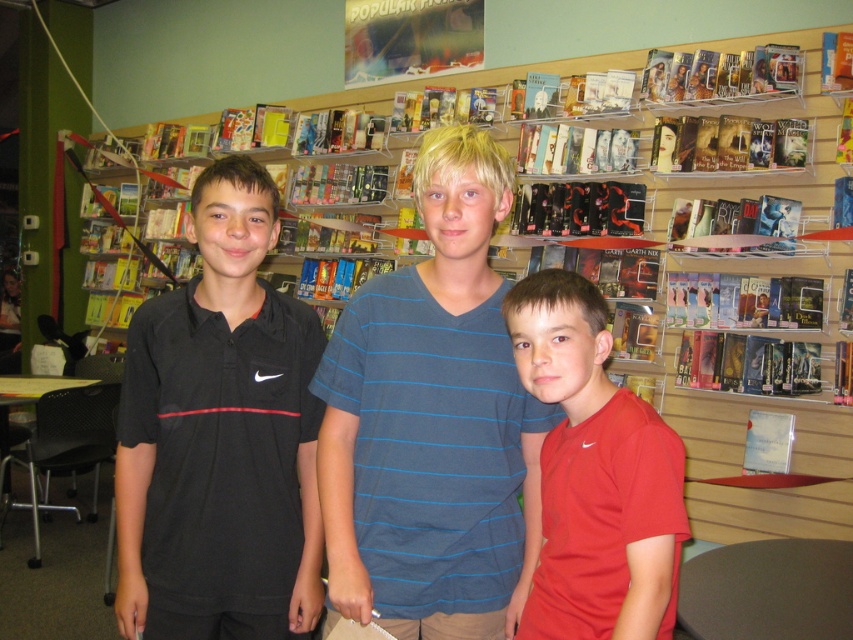
Question: Which point is farther to the camera?

Choices:
 (A) blue striped shirt at center
 (B) black nike polo shirt at left
 (C) red matte shirt at center

Answer: (B)

Question: Is blue striped shirt at center closer to the viewer compared to black nike polo shirt at left?

Choices:
 (A) yes
 (B) no

Answer: (A)

Question: Which point is farther from the camera taking this photo?

Choices:
 (A) (354, 460)
 (B) (633, 420)

Answer: (A)

Question: Can you confirm if blue striped shirt at center is positioned to the right of black nike polo shirt at left?

Choices:
 (A) no
 (B) yes

Answer: (B)

Question: Is the position of blue striped shirt at center less distant than that of black nike polo shirt at left?

Choices:
 (A) yes
 (B) no

Answer: (A)

Question: Estimate the real-world distances between objects in this image. Which object is closer to the red matte shirt at center?

Choices:
 (A) black nike polo shirt at left
 (B) blue striped shirt at center

Answer: (B)